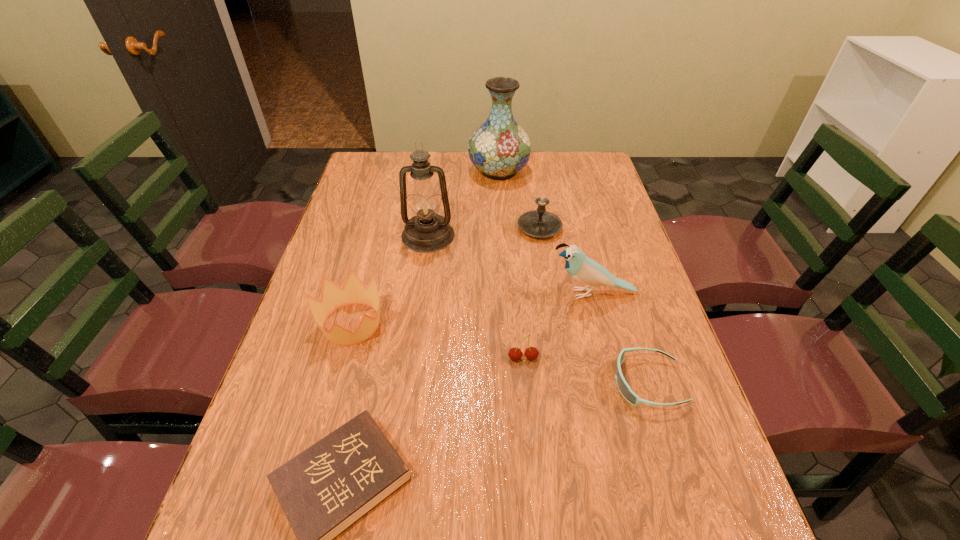
Where is `free spot located at the face of the bird`? free spot located at the face of the bird is located at coordinates (454, 294).

Identify the location of vacant area located 0.260m at the face of the bird. (450, 294).

Identify the location of vacant space located on the left of the fourth tallest object. This screenshot has width=960, height=540. [x=411, y=228].

Identify the location of free spot located 0.350m on the front of the fifth tallest object. (300, 515).

Locate an element on the screen. free location located on the surface of the third shortest object is located at coordinates (530, 436).

Identify the location of free location located on the front-facing side of the goggles. pyautogui.click(x=536, y=383).

You are a GUI agent. You are given a task and a screenshot of the screen. Output one action in this format:
    pyautogui.click(x=<x>, y=<y>)
    Task: Click on the free space located 0.280m on the front-facing side of the goggles
    This screenshot has height=540, width=960.
    Given the screenshot: What is the action you would take?
    pyautogui.click(x=486, y=383)

Where is `vacant position located 0.160m on the front-facing side of the goggles`? This screenshot has width=960, height=540. vacant position located 0.160m on the front-facing side of the goggles is located at coordinates (540, 383).

At what (x,y) coordinates should I click in order to perform the action: click on object that is at the far edge. Please return your answer as a coordinate pair (x, y). The image size is (960, 540). Looking at the image, I should click on (499, 148).

Where is `object that is at the left edge`? object that is at the left edge is located at coordinates (333, 297).